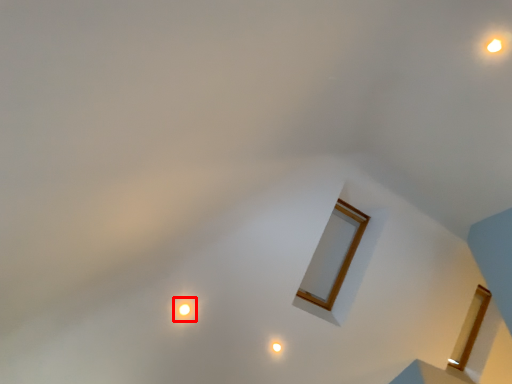
Question: From the image, what is the correct spatial relationship of glow (annotated by the red box) in relation to light?

Choices:
 (A) left
 (B) right

Answer: (A)